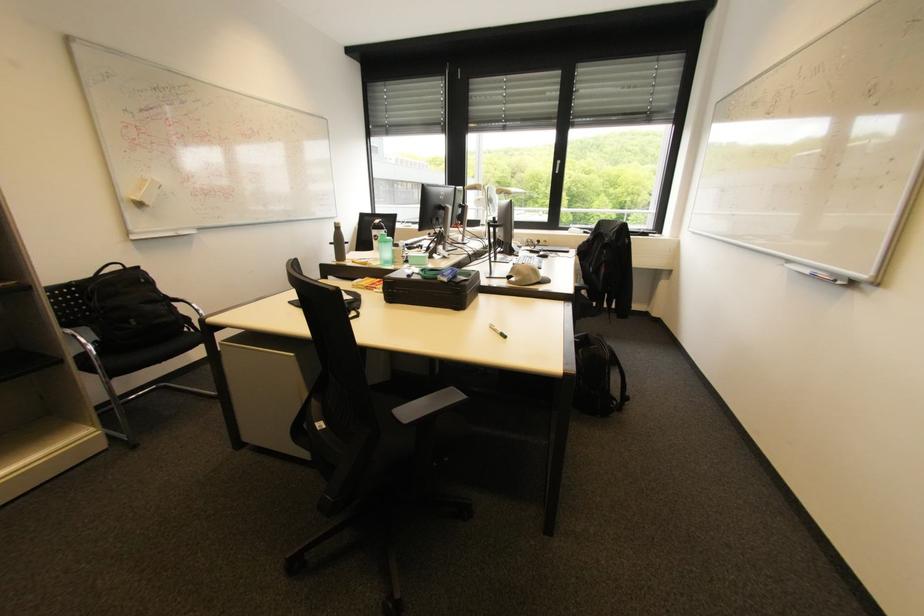
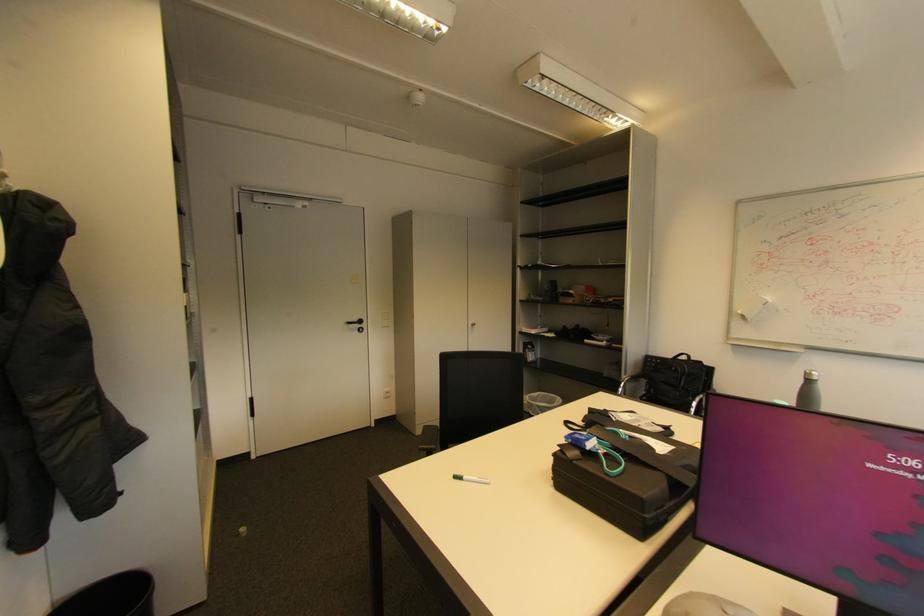
Find the pixel in the second image that matches pixel 148 281 in the first image.

(678, 369)